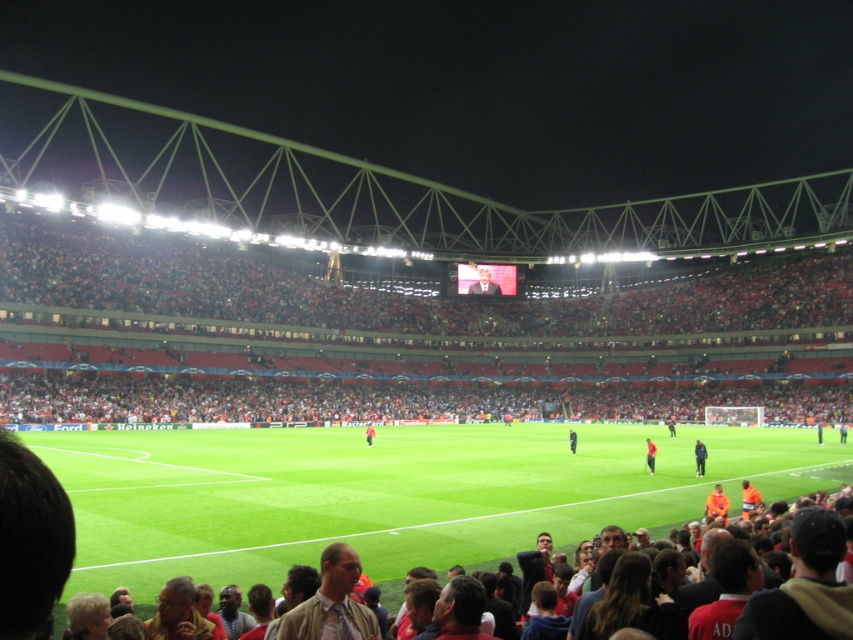
Who is higher up, green grass football field at lower center or dark blue jacket at lower right?

green grass football field at lower center

Is point (367, 502) positioned before point (694, 451)?

Yes, point (367, 502) is closer to viewer.

Identify the location of green grass football field at lower center. click(390, 493).

From the picture: Is smooth skin face at center in front of orange jersey at center?

No, smooth skin face at center is further to the viewer.

Can you confirm if smooth skin face at center is positioned to the left of orange jersey at center?

No, smooth skin face at center is not to the left of orange jersey at center.

The image size is (853, 640). What do you see at coordinates (483, 284) in the screenshot? I see `smooth skin face at center` at bounding box center [483, 284].

Locate an element on the screen. The height and width of the screenshot is (640, 853). smooth skin face at center is located at coordinates (483, 284).

Between orange shirt at center and orange jersey at center, which one appears on the left side from the viewer's perspective?

From the viewer's perspective, orange jersey at center appears more on the left side.

Between orange shirt at center and orange jersey at center, which one has less height?

orange shirt at center is shorter.

Between point (650, 452) and point (366, 438), which one is positioned in front?

Positioned in front is point (650, 452).

This screenshot has width=853, height=640. I want to click on orange shirt at center, so pos(650,454).